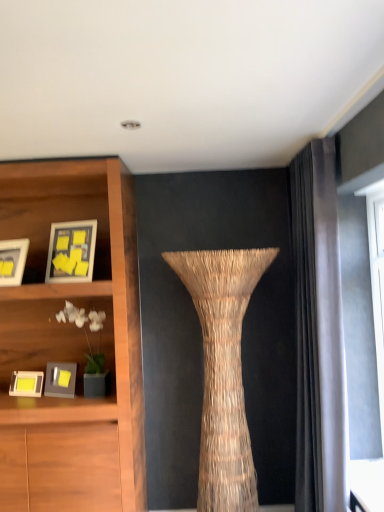
Based on the photo, measure the distance between point (52, 340) and camera.

Point (52, 340) and camera are 2.75 meters apart from each other.

The image size is (384, 512). I want to click on matte gray shelf at left, so click(x=49, y=332).

Measure the distance between point (x=62, y=394) and camera.

They are 8.35 feet apart.

What do you see at coordinates (13, 261) in the screenshot? I see `matte white picture frame at left, placed as the second picture frame when sorted from top to bottom` at bounding box center [13, 261].

Identify the location of natural fiber vase at center. (223, 371).

Which object is closer to the camera, matte yellow picture frame at left, positioned as the fourth picture frame in top-to-bottom order, or matte white picture frame at left, placed as the second picture frame when sorted from top to bottom?

matte white picture frame at left, placed as the second picture frame when sorted from top to bottom, is more forward.

Between matte yellow picture frame at left, positioned as the fourth picture frame in top-to-bottom order, and matte white picture frame at left, placed as the second picture frame when sorted from top to bottom, which one has larger size?

Bigger between the two is matte white picture frame at left, placed as the second picture frame when sorted from top to bottom.

From the image's perspective, is matte yellow picture frame at left, the 1th picture frame ordered from the bottom, located above or below matte white picture frame at left, placed as the second picture frame when sorted from top to bottom?

matte yellow picture frame at left, the 1th picture frame ordered from the bottom, is below matte white picture frame at left, placed as the second picture frame when sorted from top to bottom.

From the image's perspective, is matte wooden picture frame at upper left, positioned as the first picture frame in top-to-bottom order, below matte gray picture frame at lower left, the 2th picture frame when ordered from bottom to top?

Actually, matte wooden picture frame at upper left, positioned as the first picture frame in top-to-bottom order, appears above matte gray picture frame at lower left, the 2th picture frame when ordered from bottom to top, in the image.

Which object is further away from the camera, matte wooden picture frame at upper left, marked as the 4th picture frame in a bottom-to-top arrangement, or matte gray picture frame at lower left, arranged as the third picture frame when viewed from the top?

matte gray picture frame at lower left, arranged as the third picture frame when viewed from the top, is further from the camera.

Between matte wooden picture frame at upper left, positioned as the first picture frame in top-to-bottom order, and matte gray picture frame at lower left, the 2th picture frame when ordered from bottom to top, which one appears on the left side from the viewer's perspective?

matte gray picture frame at lower left, the 2th picture frame when ordered from bottom to top.

Between matte wooden picture frame at upper left, positioned as the first picture frame in top-to-bottom order, and matte gray picture frame at lower left, arranged as the third picture frame when viewed from the top, which one has larger size?

matte wooden picture frame at upper left, positioned as the first picture frame in top-to-bottom order.

Is natural fiber vase at center placed right next to matte gray shelf at left?

There is a gap between natural fiber vase at center and matte gray shelf at left.

Consider the image. Can you confirm if natural fiber vase at center is smaller than matte gray shelf at left?

No.

Does natural fiber vase at center turn towards matte gray shelf at left?

No, natural fiber vase at center is not aimed at matte gray shelf at left.

Is natural fiber vase at center not within matte gray shelf at left?

natural fiber vase at center lies outside matte gray shelf at left's area.

From their relative heights in the image, would you say matte wooden picture frame at upper left, positioned as the first picture frame in top-to-bottom order, is taller or shorter than matte gray shelf at left?

In the image, matte wooden picture frame at upper left, positioned as the first picture frame in top-to-bottom order, appears to be shorter than matte gray shelf at left.

Is matte wooden picture frame at upper left, positioned as the first picture frame in top-to-bottom order, facing towards matte gray shelf at left?

No, matte wooden picture frame at upper left, positioned as the first picture frame in top-to-bottom order, is not oriented towards matte gray shelf at left.

Consider the image. Who is more distant, matte wooden picture frame at upper left, marked as the 4th picture frame in a bottom-to-top arrangement, or matte gray shelf at left?

Positioned behind is matte wooden picture frame at upper left, marked as the 4th picture frame in a bottom-to-top arrangement.

From the image's perspective, is matte gray picture frame at lower left, the 2th picture frame when ordered from bottom to top, positioned above or below natural fiber vase at center?

matte gray picture frame at lower left, the 2th picture frame when ordered from bottom to top, is situated higher than natural fiber vase at center in the image.

Is matte gray picture frame at lower left, the 2th picture frame when ordered from bottom to top, looking in the opposite direction of natural fiber vase at center?

matte gray picture frame at lower left, the 2th picture frame when ordered from bottom to top, does not have its back to natural fiber vase at center.

Is matte gray picture frame at lower left, arranged as the third picture frame when viewed from the top, smaller than natural fiber vase at center?

Indeed, matte gray picture frame at lower left, arranged as the third picture frame when viewed from the top, has a smaller size compared to natural fiber vase at center.

From a real-world perspective, between matte gray picture frame at lower left, the 2th picture frame when ordered from bottom to top, and matte white picture frame at left, which ranks as the third picture frame in bottom-to-top order, who is vertically higher?

matte white picture frame at left, which ranks as the third picture frame in bottom-to-top order, from a real-world perspective.

From the image's perspective, between matte gray picture frame at lower left, the 2th picture frame when ordered from bottom to top, and matte white picture frame at left, placed as the second picture frame when sorted from top to bottom, who is located below?

matte gray picture frame at lower left, the 2th picture frame when ordered from bottom to top, is shown below in the image.

Between matte gray picture frame at lower left, the 2th picture frame when ordered from bottom to top, and matte white picture frame at left, which ranks as the third picture frame in bottom-to-top order, which one has smaller width?

With smaller width is matte white picture frame at left, which ranks as the third picture frame in bottom-to-top order.

Could you measure the distance between matte gray picture frame at lower left, the 2th picture frame when ordered from bottom to top, and matte white picture frame at left, which ranks as the third picture frame in bottom-to-top order?

A distance of 68.70 centimeters exists between matte gray picture frame at lower left, the 2th picture frame when ordered from bottom to top, and matte white picture frame at left, which ranks as the third picture frame in bottom-to-top order.

There is a natural fiber vase at center. Identify the location of the 2nd picture frame above it (from the image's perspective). The image size is (384, 512). (13, 261).

Which is more distant, (206, 416) or (12, 247)?

The point (12, 247) is behind.

Which of these two, natural fiber vase at center or matte white picture frame at left, placed as the second picture frame when sorted from top to bottom, is wider?

With larger width is natural fiber vase at center.

Where is `picture frame that is the 2nd object located below the matte white picture frame at left, placed as the second picture frame when sorted from top to bottom (from the image's perspective)`? The width and height of the screenshot is (384, 512). picture frame that is the 2nd object located below the matte white picture frame at left, placed as the second picture frame when sorted from top to bottom (from the image's perspective) is located at coordinates (26, 384).

Find the location of a particular element. the 2nd picture frame positioned above the matte gray picture frame at lower left, the 2th picture frame when ordered from bottom to top (from a real-world perspective) is located at coordinates (71, 251).

Considering their positions, is matte gray shelf at left positioned further to matte yellow picture frame at left, positioned as the fourth picture frame in top-to-bottom order, than matte gray picture frame at lower left, the 2th picture frame when ordered from bottom to top?

matte gray shelf at left is further to matte yellow picture frame at left, positioned as the fourth picture frame in top-to-bottom order.

Based on their spatial positions, is matte gray shelf at left or matte yellow picture frame at left, the 1th picture frame ordered from the bottom, further from matte gray picture frame at lower left, the 2th picture frame when ordered from bottom to top?

Based on the image, matte gray shelf at left appears to be further to matte gray picture frame at lower left, the 2th picture frame when ordered from bottom to top.

Estimate the real-world distances between objects in this image. Which object is closer to matte gray shelf at left, matte yellow picture frame at left, positioned as the fourth picture frame in top-to-bottom order, or natural fiber vase at center?

matte yellow picture frame at left, positioned as the fourth picture frame in top-to-bottom order.

Consider the image. Which object lies further to the anchor point matte gray picture frame at lower left, arranged as the third picture frame when viewed from the top, matte gray shelf at left or matte wooden picture frame at upper left, marked as the 4th picture frame in a bottom-to-top arrangement?

matte wooden picture frame at upper left, marked as the 4th picture frame in a bottom-to-top arrangement, is positioned further to the anchor matte gray picture frame at lower left, arranged as the third picture frame when viewed from the top.

From the picture: Based on their spatial positions, is natural fiber vase at center or matte white picture frame at left, which ranks as the third picture frame in bottom-to-top order, closer to matte gray picture frame at lower left, the 2th picture frame when ordered from bottom to top?

matte white picture frame at left, which ranks as the third picture frame in bottom-to-top order, is positioned closer to the anchor matte gray picture frame at lower left, the 2th picture frame when ordered from bottom to top.

When comparing their distances from natural fiber vase at center, does matte gray shelf at left or matte wooden picture frame at upper left, marked as the 4th picture frame in a bottom-to-top arrangement, seem closer?

matte wooden picture frame at upper left, marked as the 4th picture frame in a bottom-to-top arrangement, is closer to natural fiber vase at center.

Considering their positions, is matte wooden picture frame at upper left, positioned as the first picture frame in top-to-bottom order, positioned further to matte gray picture frame at lower left, the 2th picture frame when ordered from bottom to top, than matte white picture frame at left, which ranks as the third picture frame in bottom-to-top order?

The object further to matte gray picture frame at lower left, the 2th picture frame when ordered from bottom to top, is matte wooden picture frame at upper left, positioned as the first picture frame in top-to-bottom order.

From the image, which object appears to be nearer to matte gray picture frame at lower left, arranged as the third picture frame when viewed from the top, matte yellow picture frame at left, positioned as the fourth picture frame in top-to-bottom order, or matte white picture frame at left, placed as the second picture frame when sorted from top to bottom?

Based on the image, matte yellow picture frame at left, positioned as the fourth picture frame in top-to-bottom order, appears to be nearer to matte gray picture frame at lower left, arranged as the third picture frame when viewed from the top.

Locate an element on the screen. shelf situated between matte yellow picture frame at left, the 1th picture frame ordered from the bottom, and natural fiber vase at center from left to right is located at coordinates [49, 332].

Locate an element on the screen. This screenshot has height=512, width=384. shelf between matte wooden picture frame at upper left, marked as the 4th picture frame in a bottom-to-top arrangement, and matte gray picture frame at lower left, arranged as the third picture frame when viewed from the top, in the vertical direction is located at coordinates (49, 332).

In order to click on shelf between matte white picture frame at left, which ranks as the third picture frame in bottom-to-top order, and matte gray picture frame at lower left, the 2th picture frame when ordered from bottom to top, from top to bottom in this screenshot , I will do `click(49, 332)`.

Locate an element on the screen. The height and width of the screenshot is (512, 384). shelf between matte white picture frame at left, placed as the second picture frame when sorted from top to bottom, and matte yellow picture frame at left, the 1th picture frame ordered from the bottom, vertically is located at coordinates (49, 332).